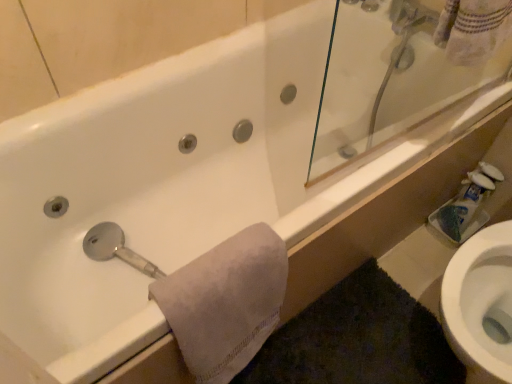
Question: From a real-world perspective, is white soft towel at lower left positioned over white matte toilet paper at right based on gravity?

Choices:
 (A) yes
 (B) no

Answer: (A)

Question: Is white soft towel at lower left aimed at white matte toilet paper at right?

Choices:
 (A) yes
 (B) no

Answer: (B)

Question: Is white soft towel at lower left not within white matte toilet paper at right?

Choices:
 (A) yes
 (B) no

Answer: (A)

Question: Is white soft towel at lower left bigger than white matte toilet paper at right?

Choices:
 (A) no
 (B) yes

Answer: (B)

Question: Considering the relative positions of white soft towel at lower left and white matte toilet paper at right in the image provided, is white soft towel at lower left to the right of white matte toilet paper at right from the viewer's perspective?

Choices:
 (A) yes
 (B) no

Answer: (B)

Question: Is white soft towel at lower left thinner than white matte toilet paper at right?

Choices:
 (A) yes
 (B) no

Answer: (B)

Question: Is white matte toilet paper at right bigger than white soft towel at lower left?

Choices:
 (A) no
 (B) yes

Answer: (A)

Question: Is white soft towel at lower left at the back of white matte toilet paper at right?

Choices:
 (A) yes
 (B) no

Answer: (B)

Question: Is white matte toilet paper at right far away from white soft towel at lower left?

Choices:
 (A) no
 (B) yes

Answer: (A)

Question: Is white matte toilet paper at right facing towards white soft towel at lower left?

Choices:
 (A) no
 (B) yes

Answer: (B)

Question: Considering the relative positions of white matte toilet paper at right and white soft towel at lower left in the image provided, is white matte toilet paper at right to the left of white soft towel at lower left from the viewer's perspective?

Choices:
 (A) yes
 (B) no

Answer: (B)

Question: Is white matte toilet paper at right behind white soft towel at lower left?

Choices:
 (A) no
 (B) yes

Answer: (B)

Question: Relative to white soft towel at lower left, is white matte toilet paper at right in front or behind?

Choices:
 (A) front
 (B) behind

Answer: (B)